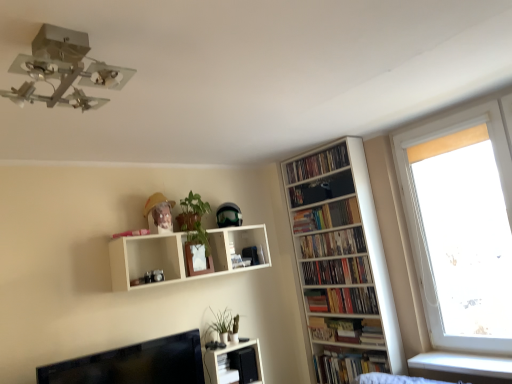
Question: Considering the relative sizes of wooden shelf at upper right, which is counted as the first book, starting from the top, and green matte plant at upper center, arranged as the first plant when viewed from the top, in the image provided, is wooden shelf at upper right, which is counted as the first book, starting from the top, shorter than green matte plant at upper center, arranged as the first plant when viewed from the top,?

Choices:
 (A) no
 (B) yes

Answer: (B)

Question: Can you confirm if wooden shelf at upper right, which is counted as the first book, starting from the top, is wider than green matte plant at upper center, arranged as the first plant when viewed from the top?

Choices:
 (A) no
 (B) yes

Answer: (A)

Question: Is green matte plant at upper center, placed as the 2th plant when sorted from bottom to top, located within wooden shelf at upper right, positioned as the sixth book in bottom-to-top order?

Choices:
 (A) yes
 (B) no

Answer: (B)

Question: Does wooden shelf at upper right, positioned as the sixth book in bottom-to-top order, appear on the right side of green matte plant at upper center, placed as the 2th plant when sorted from bottom to top?

Choices:
 (A) yes
 (B) no

Answer: (A)

Question: Can you confirm if wooden shelf at upper right, which is counted as the first book, starting from the top, is thinner than green matte plant at upper center, arranged as the first plant when viewed from the top?

Choices:
 (A) yes
 (B) no

Answer: (A)

Question: From the image's perspective, is hardcover books at upper right, placed as the fifth book when sorted from bottom to top, above or below white matte shelf at upper center, which is counted as the 1th shelf, starting from the top?

Choices:
 (A) below
 (B) above

Answer: (B)

Question: Is point (335, 223) positioned closer to the camera than point (126, 266)?

Choices:
 (A) farther
 (B) closer

Answer: (A)

Question: Looking at the image, does hardcover books at upper right, placed as the fifth book when sorted from bottom to top, seem bigger or smaller compared to white matte shelf at upper center, the 2th shelf in the bottom-to-top sequence?

Choices:
 (A) big
 (B) small

Answer: (B)

Question: From their relative heights in the image, would you say hardcover books at upper right, placed as the fifth book when sorted from bottom to top, is taller or shorter than white matte shelf at upper center, the 2th shelf in the bottom-to-top sequence?

Choices:
 (A) short
 (B) tall

Answer: (A)

Question: Looking at the image, does hardcover books at right, which is the 4th book from top to bottom, seem bigger or smaller compared to black glossy monitor at lower left?

Choices:
 (A) big
 (B) small

Answer: (B)

Question: Is hardcover books at right, which is the 4th book from top to bottom, to the left or to the right of black glossy monitor at lower left in the image?

Choices:
 (A) right
 (B) left

Answer: (A)

Question: In the image, is hardcover books at right, positioned as the third book in bottom-to-top order, positioned in front of or behind black glossy monitor at lower left?

Choices:
 (A) front
 (B) behind

Answer: (B)

Question: Is hardcover books at right, which is the 4th book from top to bottom, wider or thinner than black glossy monitor at lower left?

Choices:
 (A) thin
 (B) wide

Answer: (B)

Question: Considering their positions, is hardcover books at lower right, which is the 1th book in bottom-to-top order, located in front of or behind white wooden bookcase at right?

Choices:
 (A) behind
 (B) front

Answer: (A)

Question: Is point (372, 350) positioned closer to the camera than point (352, 291)?

Choices:
 (A) farther
 (B) closer

Answer: (B)